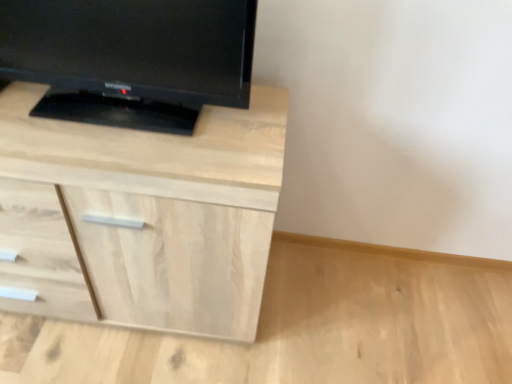
Question: Is matte black tv at upper left positioned in front of light wood chest of drawers at upper left?

Choices:
 (A) no
 (B) yes

Answer: (B)

Question: Is matte black tv at upper left wider than light wood chest of drawers at upper left?

Choices:
 (A) no
 (B) yes

Answer: (A)

Question: Considering the relative sizes of matte black tv at upper left and light wood chest of drawers at upper left in the image provided, is matte black tv at upper left thinner than light wood chest of drawers at upper left?

Choices:
 (A) no
 (B) yes

Answer: (B)

Question: Can you confirm if matte black tv at upper left is smaller than light wood chest of drawers at upper left?

Choices:
 (A) no
 (B) yes

Answer: (B)

Question: Is matte black tv at upper left far from light wood chest of drawers at upper left?

Choices:
 (A) yes
 (B) no

Answer: (B)

Question: Can you confirm if matte black tv at upper left is positioned to the right of light wood chest of drawers at upper left?

Choices:
 (A) no
 (B) yes

Answer: (B)

Question: Does light wood chest of drawers at upper left have a lesser height compared to matte black tv at upper left?

Choices:
 (A) no
 (B) yes

Answer: (A)

Question: Is light wood chest of drawers at upper left thinner than matte black tv at upper left?

Choices:
 (A) no
 (B) yes

Answer: (A)

Question: Is light wood chest of drawers at upper left at the right side of matte black tv at upper left?

Choices:
 (A) no
 (B) yes

Answer: (A)

Question: From a real-world perspective, does light wood chest of drawers at upper left stand above matte black tv at upper left?

Choices:
 (A) yes
 (B) no

Answer: (B)

Question: From a real-world perspective, is light wood chest of drawers at upper left below matte black tv at upper left?

Choices:
 (A) no
 (B) yes

Answer: (B)

Question: Is the surface of light wood chest of drawers at upper left in direct contact with matte black tv at upper left?

Choices:
 (A) no
 (B) yes

Answer: (A)

Question: From the image's perspective, relative to light wood chest of drawers at upper left, is matte black tv at upper left above or below?

Choices:
 (A) below
 (B) above

Answer: (B)